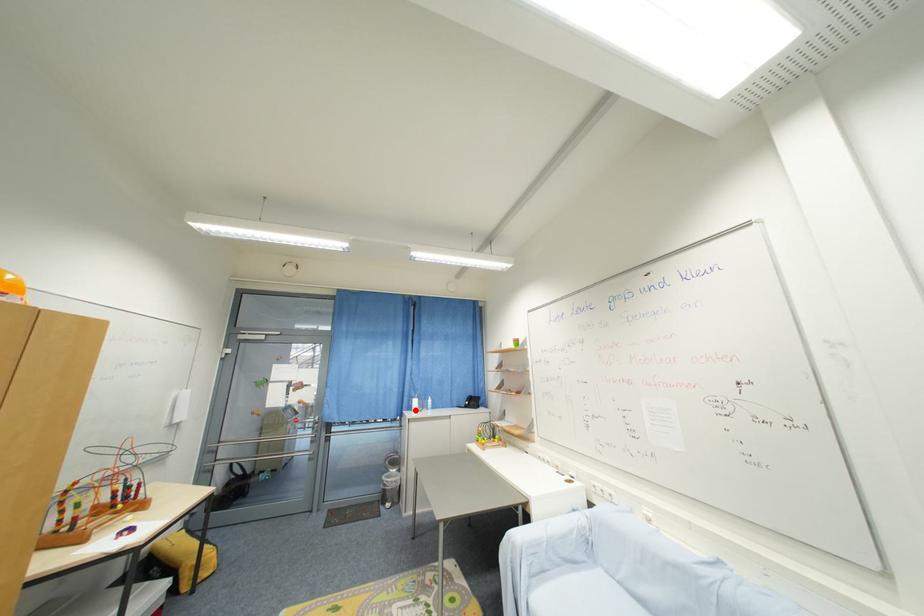
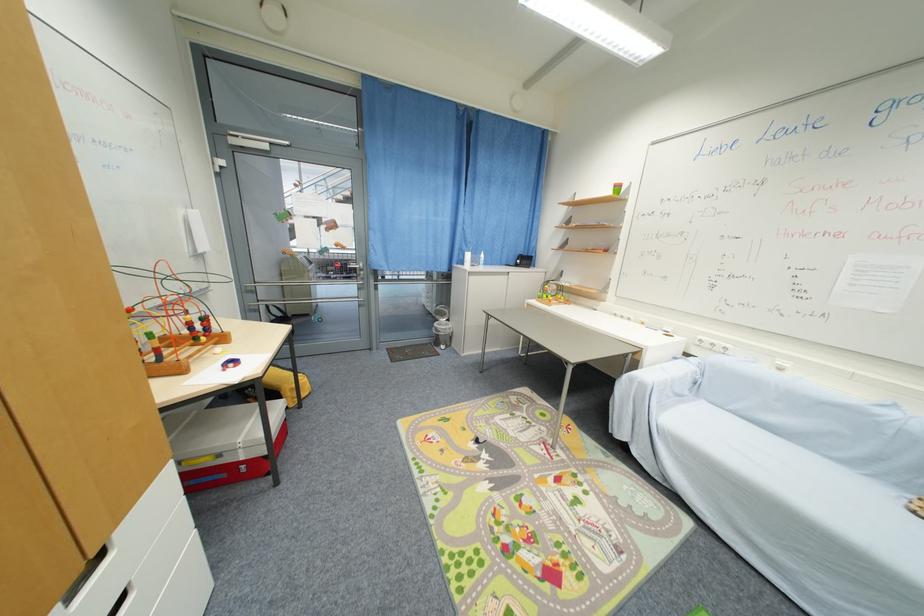
In the second image, find the point that corresponds to the highlighted location in the first image.

(467, 264)